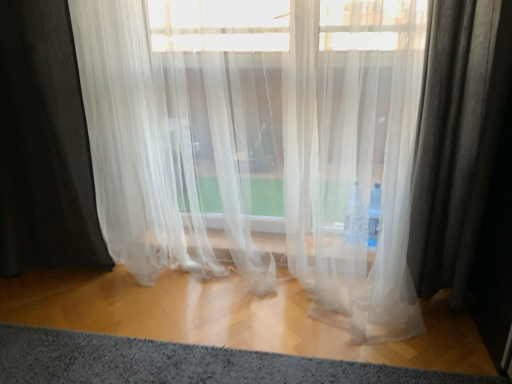
Describe the element at coordinates (182, 363) in the screenshot. I see `gray soft rug at lower center` at that location.

What is the approximate width of gray soft rug at lower center?

The width of gray soft rug at lower center is 12.02 inches.

Locate an element on the screen. The width and height of the screenshot is (512, 384). gray soft rug at lower center is located at coordinates (182, 363).

What is the approximate width of translucent white curtain at center?

translucent white curtain at center is 14.61 inches in width.

Where is `translucent white curtain at center`? translucent white curtain at center is located at coordinates (260, 141).

The height and width of the screenshot is (384, 512). What do you see at coordinates (260, 141) in the screenshot?
I see `translucent white curtain at center` at bounding box center [260, 141].

The image size is (512, 384). Identify the location of gray soft rug at lower center. (182, 363).

Is translucent white curtain at center to the right of gray soft rug at lower center from the viewer's perspective?

Correct, you'll find translucent white curtain at center to the right of gray soft rug at lower center.

Relative to gray soft rug at lower center, is translucent white curtain at center in front or behind?

Visually, translucent white curtain at center is located behind gray soft rug at lower center.

Which is farther, (350, 235) or (182, 347)?

The point (350, 235) is farther.

From the image's perspective, is translucent white curtain at center located above or below gray soft rug at lower center?

Clearly, from the image's perspective, translucent white curtain at center is above gray soft rug at lower center.

From a real-world perspective, which object stands above the other?

translucent white curtain at center.

Is translucent white curtain at center thinner than gray soft rug at lower center?

No.

Considering the relative sizes of translucent white curtain at center and gray soft rug at lower center in the image provided, is translucent white curtain at center taller than gray soft rug at lower center?

Correct, translucent white curtain at center is much taller as gray soft rug at lower center.

Which of these two, translucent white curtain at center or gray soft rug at lower center, is smaller?

gray soft rug at lower center.

Is gray soft rug at lower center completely or partially inside translucent white curtain at center?

No, translucent white curtain at center does not contain gray soft rug at lower center.

Is translucent white curtain at center not near gray soft rug at lower center?

No, translucent white curtain at center is in close proximity to gray soft rug at lower center.

Could you tell me if translucent white curtain at center is turned towards gray soft rug at lower center?

Yes.

How far apart are translucent white curtain at center and gray soft rug at lower center?

29.61 inches.

Where is `curtain that is on the right side of gray soft rug at lower center`? The height and width of the screenshot is (384, 512). curtain that is on the right side of gray soft rug at lower center is located at coordinates (260, 141).

Is gray soft rug at lower center at the left side of translucent white curtain at center?

Yes, gray soft rug at lower center is to the left of translucent white curtain at center.

In the image, is gray soft rug at lower center positioned in front of or behind translucent white curtain at center?

Visually, gray soft rug at lower center is located in front of translucent white curtain at center.

Considering the positions of point (218, 369) and point (160, 197), is point (218, 369) closer or farther from the camera than point (160, 197)?

Point (218, 369) is positioned closer to the camera compared to point (160, 197).

From the image's perspective, relative to translucent white curtain at center, is gray soft rug at lower center above or below?

Based on their image positions, gray soft rug at lower center is located beneath translucent white curtain at center.

From a real-world perspective, is gray soft rug at lower center physically above translucent white curtain at center?

No, from a real-world perspective, gray soft rug at lower center is not above translucent white curtain at center.

Considering the relative sizes of gray soft rug at lower center and translucent white curtain at center in the image provided, is gray soft rug at lower center wider than translucent white curtain at center?

In fact, gray soft rug at lower center might be narrower than translucent white curtain at center.

Considering the sizes of objects gray soft rug at lower center and translucent white curtain at center in the image provided, who is shorter, gray soft rug at lower center or translucent white curtain at center?

Standing shorter between the two is gray soft rug at lower center.

Who is bigger, gray soft rug at lower center or translucent white curtain at center?

translucent white curtain at center.

Is gray soft rug at lower center not inside translucent white curtain at center?

Yes, gray soft rug at lower center is not within translucent white curtain at center.

Is gray soft rug at lower center far from translucent white curtain at center?

They are positioned close to each other.

Does gray soft rug at lower center turn towards translucent white curtain at center?

No, gray soft rug at lower center is not facing towards translucent white curtain at center.

In the scene shown: How much distance is there between gray soft rug at lower center and translucent white curtain at center?

The distance of gray soft rug at lower center from translucent white curtain at center is 29.61 inches.

Find the location of a particular element. curtain that is above the gray soft rug at lower center (from a real-world perspective) is located at coordinates (260, 141).

Locate an element on the screen. doormat in front of the translucent white curtain at center is located at coordinates (182, 363).

Locate an element on the screen. This screenshot has width=512, height=384. curtain on the right of gray soft rug at lower center is located at coordinates (260, 141).